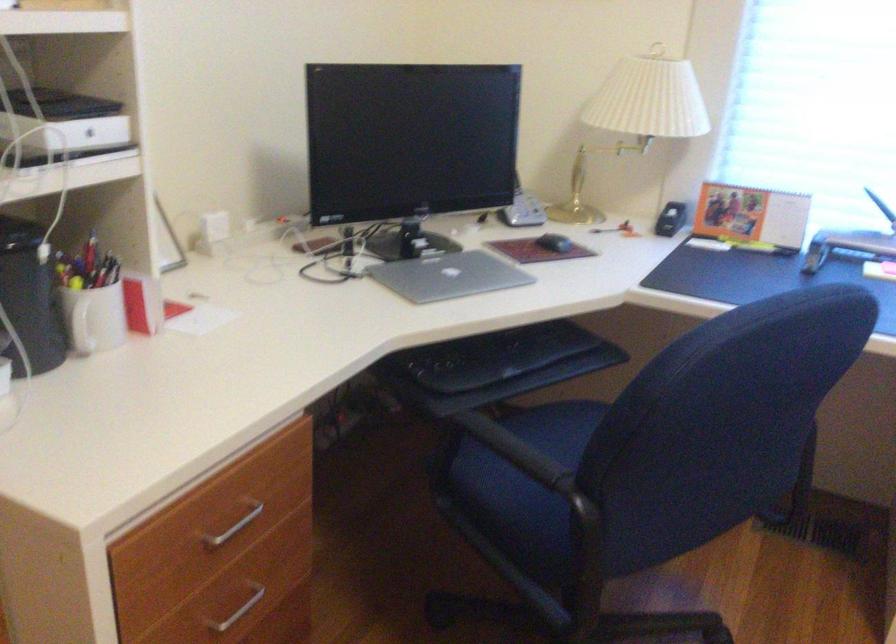
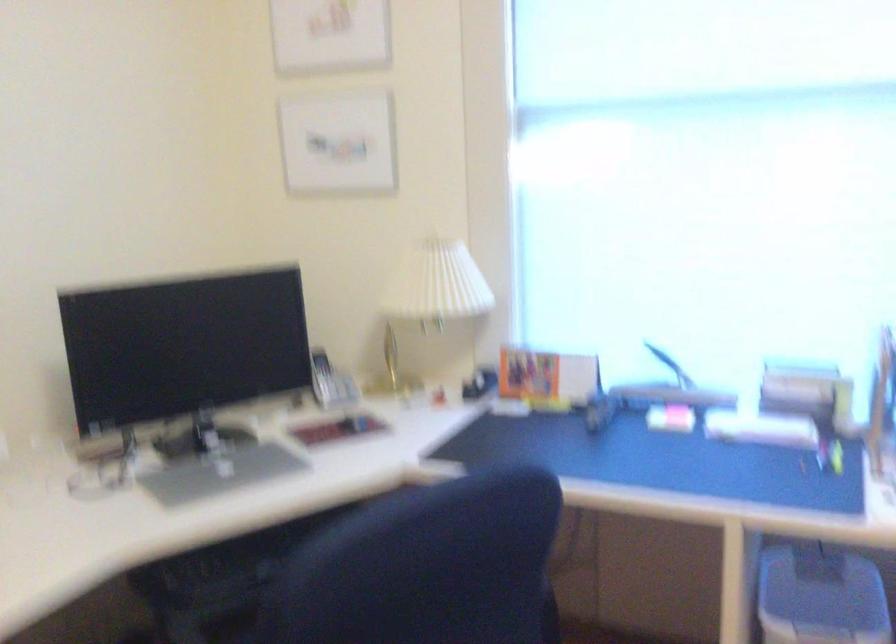
In the second image, find the point that corresponds to pixel 521 202 in the first image.

(330, 382)